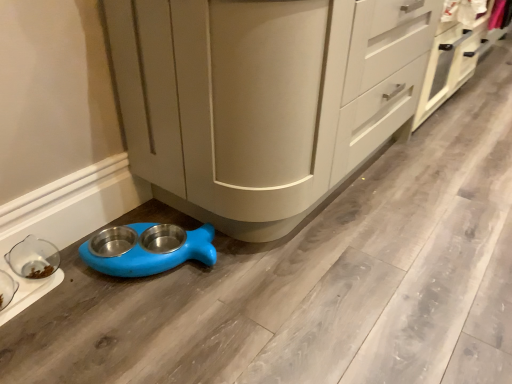
Find the location of a particular element. This screenshot has height=384, width=512. vacant space in between matte beige cabinet at lower center, the first cabinetry in the left-to-right sequence, and blue plastic pet feeder at lower left, which is the 2th appliance from left to right is located at coordinates click(174, 273).